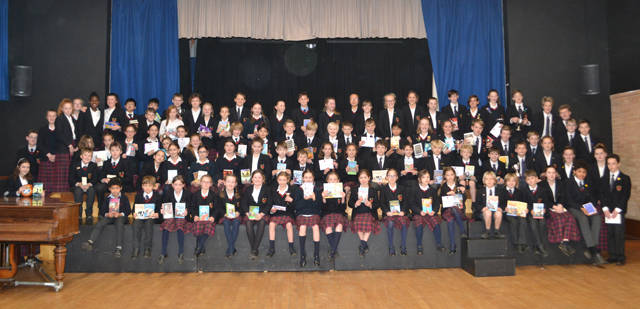
Find the location of `curtains`. curtains is located at coordinates (3, 65), (146, 34), (258, 20), (371, 23), (476, 44), (219, 65), (184, 65), (411, 61).